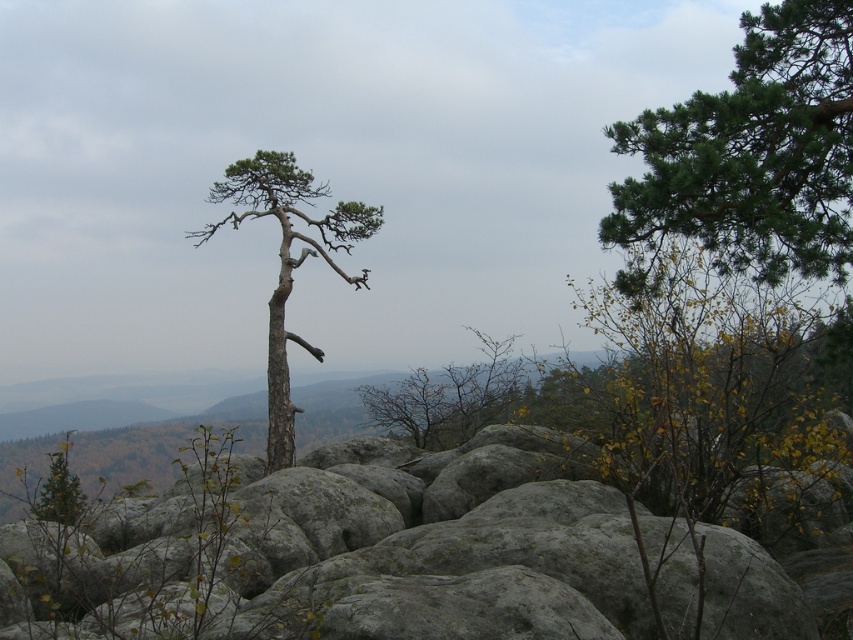
Question: Can you confirm if green leafy bush at center is positioned to the left of gray bark tree at center?

Choices:
 (A) no
 (B) yes

Answer: (A)

Question: Based on their relative distances, which object is nearer to the green needle-like branches at upper right?

Choices:
 (A) green leafy bush at center
 (B) gray bark tree at center

Answer: (A)

Question: Can you confirm if green needle-like branches at upper right is wider than gray bark tree at center?

Choices:
 (A) yes
 (B) no

Answer: (B)

Question: Which object appears farthest from the camera in this image?

Choices:
 (A) gray bark tree at center
 (B) green leafy bush at center
 (C) green needle-like branches at upper right

Answer: (A)

Question: Does green leafy bush at center appear on the right side of green needle-like branches at upper right?

Choices:
 (A) no
 (B) yes

Answer: (B)

Question: Among these points, which one is nearest to the camera?

Choices:
 (A) (187, 236)
 (B) (726, 436)
 (C) (683, 221)

Answer: (C)